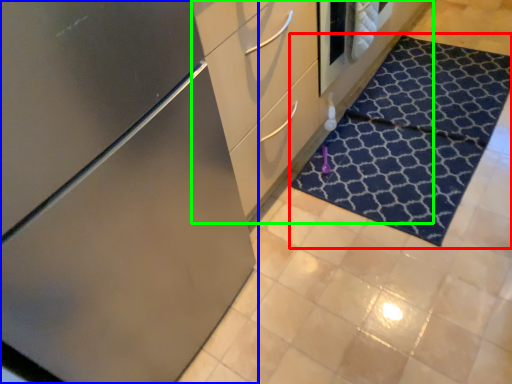
Question: Based on their relative distances, which object is farther from doormat (highlighted by a red box)? Choose from cabinetry (highlighted by a blue box) and dresser (highlighted by a green box).

Choices:
 (A) cabinetry
 (B) dresser

Answer: (A)